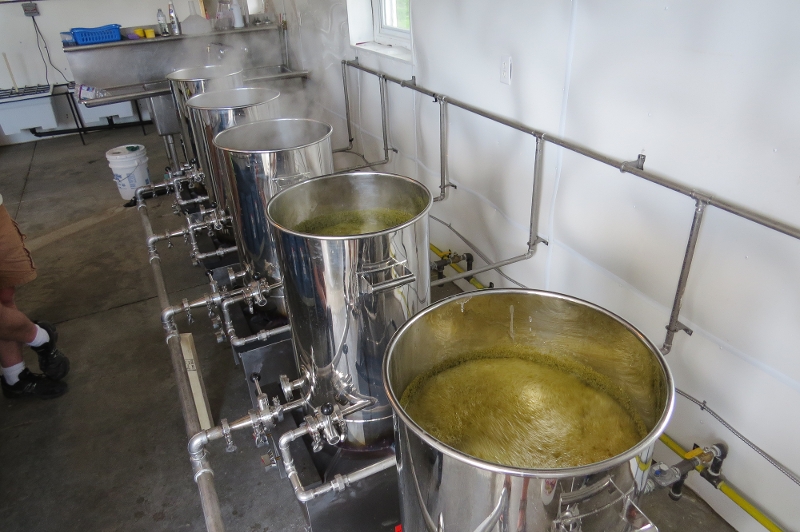
This screenshot has width=800, height=532. I want to click on bucket, so click(122, 160).